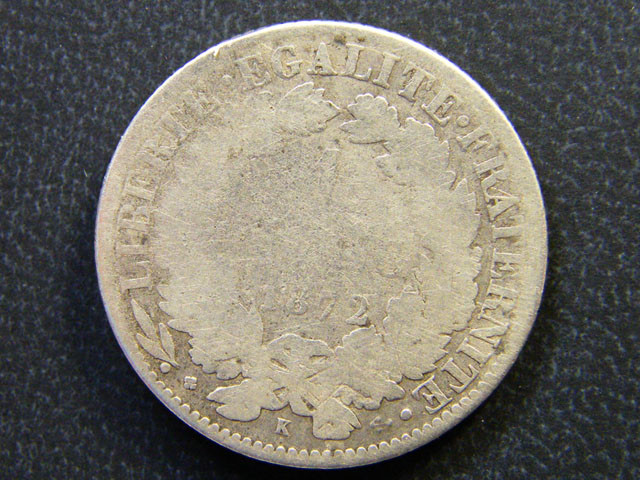
Identify the location of wreath. The image size is (640, 480). [413, 160], [361, 361], [214, 334].